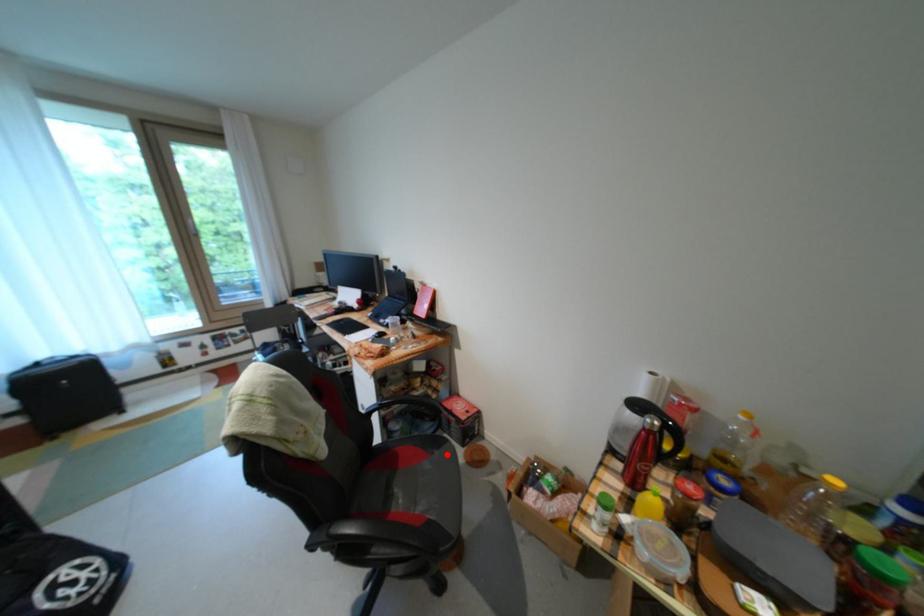
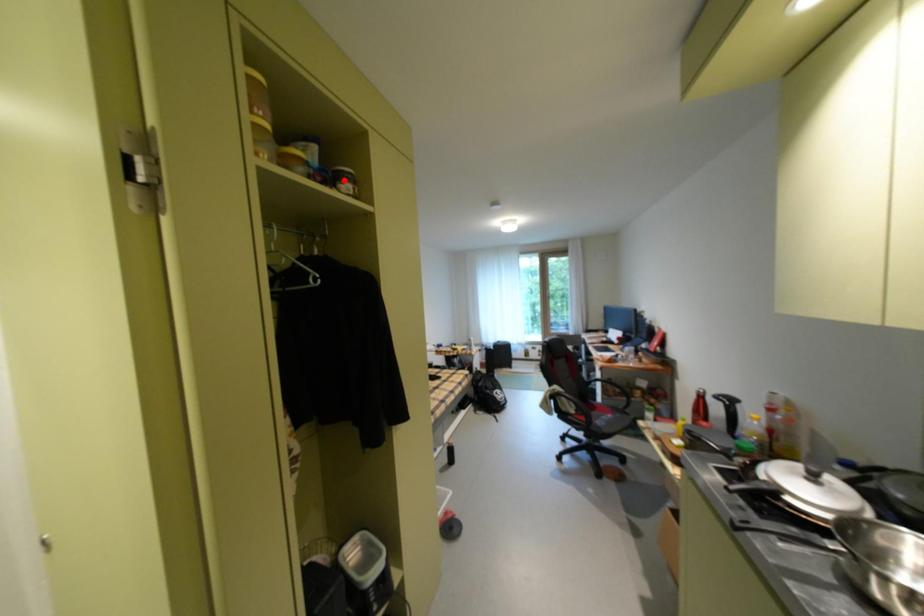
I am providing you with two images of the same scene from different viewpoints. A red point is marked on the first image and another point is marked on the second image. Is the marked point in image1 the same physical position as the marked point in image2?

No